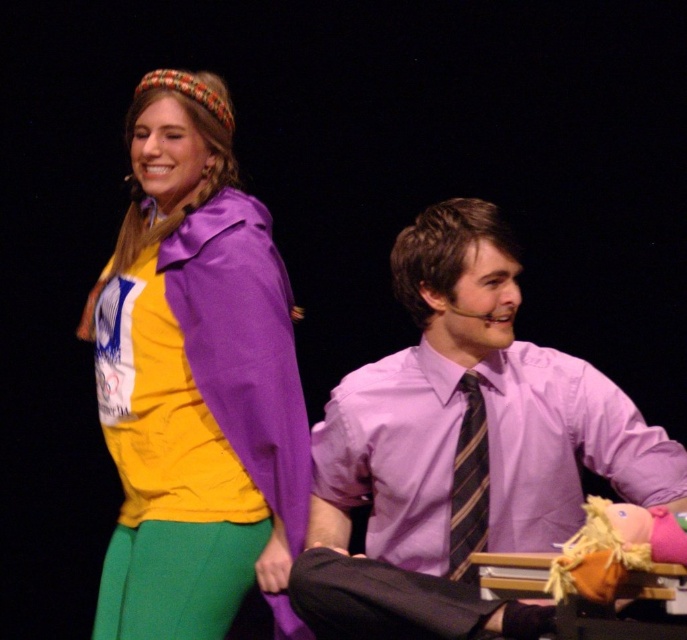
Question: Is fluffy yellow puppet at lower right above striped fabric tie at center?

Choices:
 (A) yes
 (B) no

Answer: (B)

Question: Which object is the farthest from the matte purple jacket at upper left?

Choices:
 (A) striped fabric tie at center
 (B) purple smooth shirt at center
 (C) fluffy yellow puppet at lower right

Answer: (C)

Question: Does purple smooth shirt at center appear over matte purple jacket at upper left?

Choices:
 (A) yes
 (B) no

Answer: (B)

Question: Which point is closer to the camera taking this photo?

Choices:
 (A) (464, 528)
 (B) (638, 413)

Answer: (A)

Question: Can you confirm if purple smooth shirt at center is smaller than striped fabric tie at center?

Choices:
 (A) yes
 (B) no

Answer: (B)

Question: Which object appears closest to the camera in this image?

Choices:
 (A) matte purple jacket at upper left
 (B) striped fabric tie at center
 (C) purple smooth shirt at center

Answer: (C)